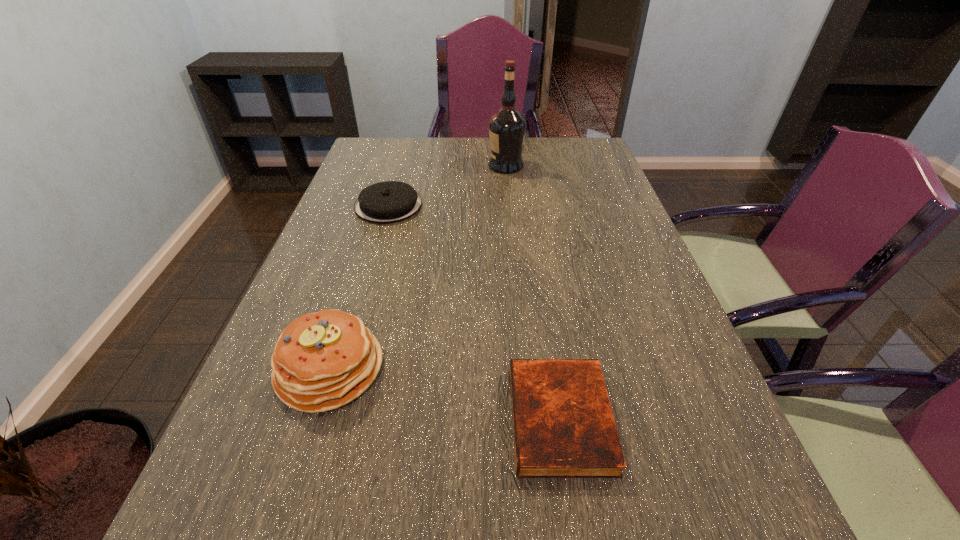
The image size is (960, 540). In the image, there is a desktop. What are the coordinates of `vacant region at the far right corner` in the screenshot? It's located at (559, 157).

This screenshot has height=540, width=960. Find the location of `free area in between the shortest object and the taller pancake`. free area in between the shortest object and the taller pancake is located at coordinates (445, 394).

The image size is (960, 540). Identify the location of unoccupied position between the tallest object and the shortest object. (533, 292).

I want to click on blank region between the third shortest object and the farther pancake, so click(359, 287).

The image size is (960, 540). Find the location of `free space that is in between the farthest object and the Bible`. free space that is in between the farthest object and the Bible is located at coordinates (533, 292).

Locate an element on the screen. This screenshot has width=960, height=540. vacant space in between the taller pancake and the Bible is located at coordinates (445, 394).

The width and height of the screenshot is (960, 540). In order to click on vacant area that lies between the farthest object and the shortest object in this screenshot , I will do `click(533, 292)`.

I want to click on empty space between the farthest object and the second shortest object, so click(x=447, y=186).

What are the coordinates of `free spot between the nearer pancake and the shorter pancake` in the screenshot? It's located at (359, 287).

Where is `vacant area that lies between the shortest object and the tallest object`? Image resolution: width=960 pixels, height=540 pixels. vacant area that lies between the shortest object and the tallest object is located at coordinates (533, 292).